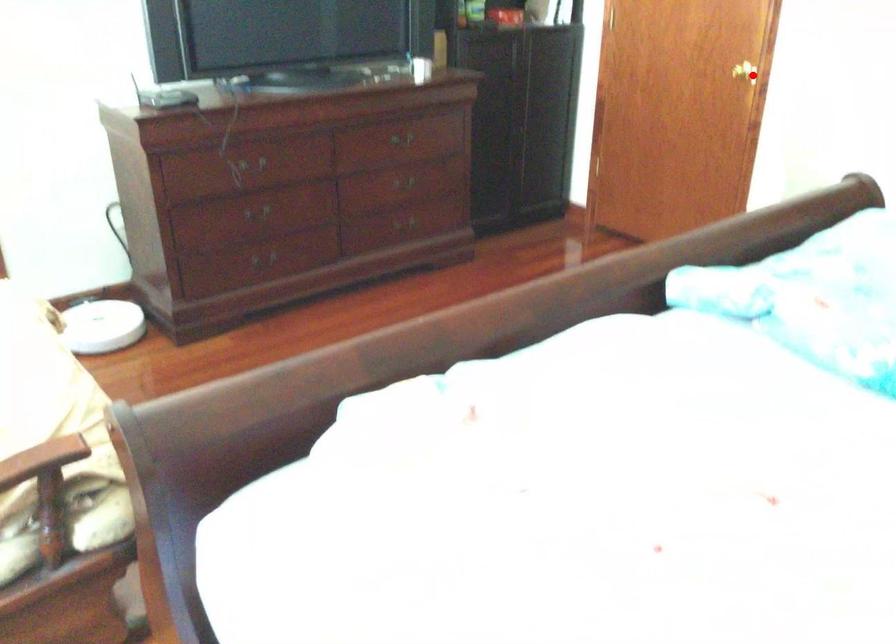
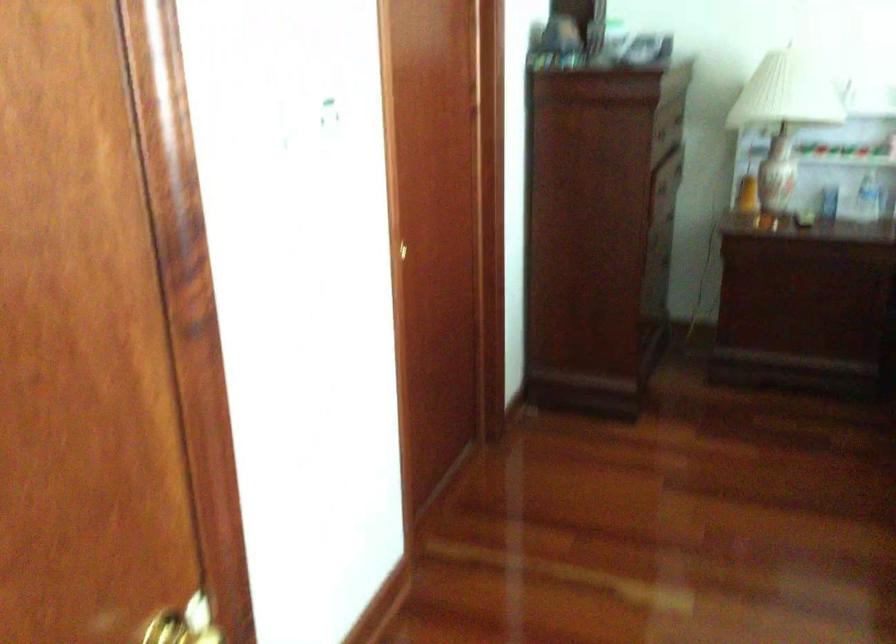
Where in the second image is the point corresponding to the highlighted location from the first image?

(185, 623)